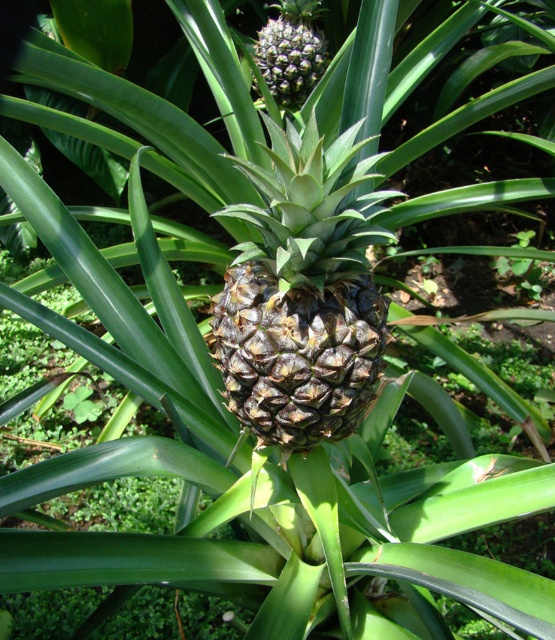
Describe the element at coordinates (302, 292) in the screenshot. I see `brown rough pineapple at center` at that location.

Does point (341, 326) come in front of point (292, 48)?

Yes, it is.

Is point (243, 269) more distant than point (273, 65)?

No, (243, 269) is in front of (273, 65).

Where is `brown rough pineapple at center`? This screenshot has height=640, width=555. brown rough pineapple at center is located at coordinates (302, 292).